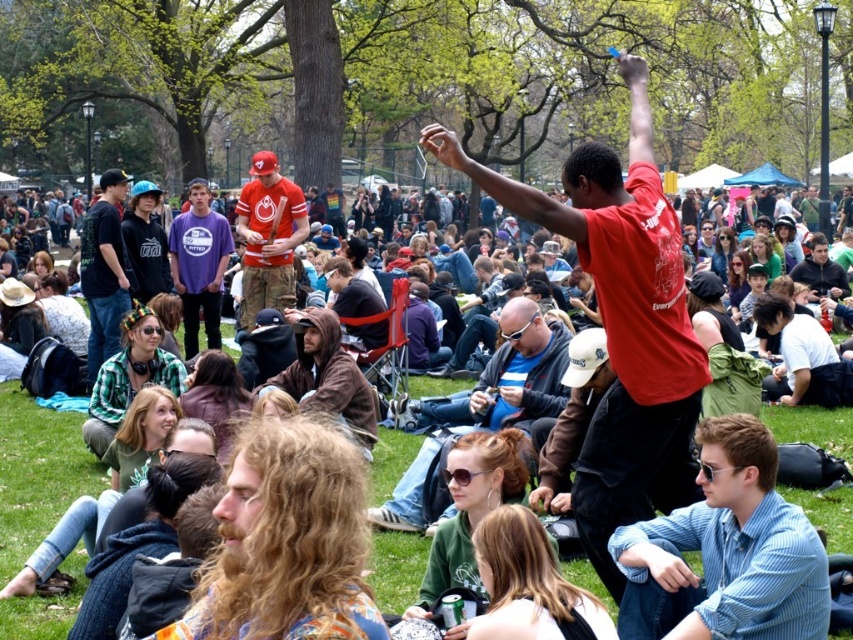
Question: Can you confirm if blue striped shirt at center is positioned below matte red cap at center?

Choices:
 (A) no
 (B) yes

Answer: (B)

Question: Does matte red shirt at center appear on the left side of blue striped shirt at center?

Choices:
 (A) no
 (B) yes

Answer: (B)

Question: Does matte red cap at center have a lesser width compared to matte black jacket at left?

Choices:
 (A) no
 (B) yes

Answer: (A)

Question: Among these objects, which one is farthest from the camera?

Choices:
 (A) matte brown leather jacket at center
 (B) blue striped shirt at center
 (C) matte red shirt at center

Answer: (A)

Question: Which of the following is the farthest from the observer?

Choices:
 (A) blue striped shirt at center
 (B) matte brown leather jacket at center
 (C) matte red cap at center
 (D) matte black jacket at left

Answer: (C)

Question: Which of the following is the closest to the observer?

Choices:
 (A) matte red shirt at center
 (B) matte brown leather jacket at center

Answer: (A)